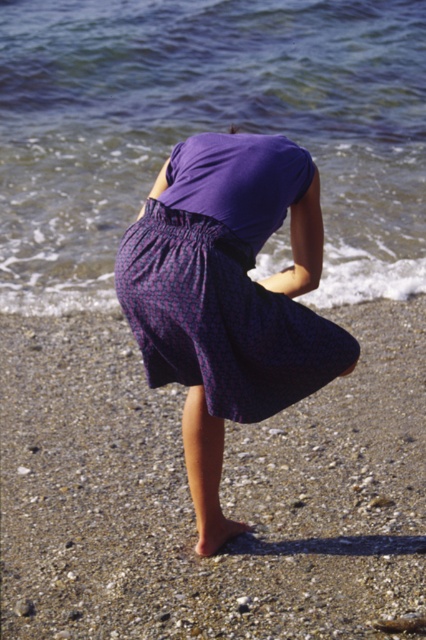
Is clear water at lower left smaller than purple woven skirt at center?

No.

From the picture: Which is more to the right, clear water at lower left or purple woven skirt at center?

purple woven skirt at center

Which is in front, point (414, 147) or point (268, 193)?

Point (268, 193)

This screenshot has width=426, height=640. In order to click on clear water at lower left in this screenshot , I will do `click(206, 129)`.

Can you confirm if smooth pebbled sand at lower center is positioned to the left of clear water at lower left?

In fact, smooth pebbled sand at lower center is to the right of clear water at lower left.

Which is behind, point (374, 586) or point (28, 70)?

Positioned behind is point (28, 70).

I want to click on smooth pebbled sand at lower center, so click(x=221, y=496).

Does smooth pebbled sand at lower center come behind purple woven skirt at center?

No, it is not.

Does smooth pebbled sand at lower center have a greater height compared to purple woven skirt at center?

No.

This screenshot has width=426, height=640. What do you see at coordinates (221, 496) in the screenshot?
I see `smooth pebbled sand at lower center` at bounding box center [221, 496].

This screenshot has width=426, height=640. I want to click on smooth pebbled sand at lower center, so click(221, 496).